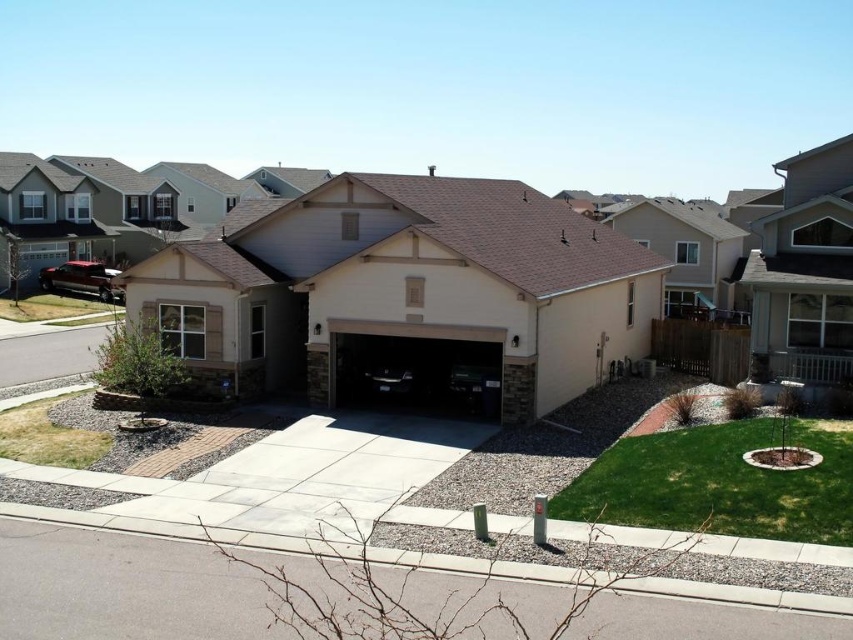
Question: Is beige stucco garage at center closer to the viewer compared to gray concrete driveway at center?

Choices:
 (A) yes
 (B) no

Answer: (B)

Question: Considering the relative positions of gray concrete driveway at center and matte black car at center in the image provided, where is gray concrete driveway at center located with respect to matte black car at center?

Choices:
 (A) above
 (B) below

Answer: (B)

Question: Considering the real-world distances, which object is closest to the beige stucco garage at center?

Choices:
 (A) gray concrete driveway at center
 (B) matte black car at center

Answer: (B)

Question: Can you confirm if gray concrete driveway at center is positioned below matte black car at center?

Choices:
 (A) yes
 (B) no

Answer: (A)

Question: Which point is farther from the camera taking this photo?

Choices:
 (A) (219, 573)
 (B) (389, 387)
 (C) (386, 321)

Answer: (B)

Question: Based on their relative distances, which object is nearer to the gray concrete driveway at center?

Choices:
 (A) matte black car at center
 (B) beige stucco garage at center

Answer: (B)